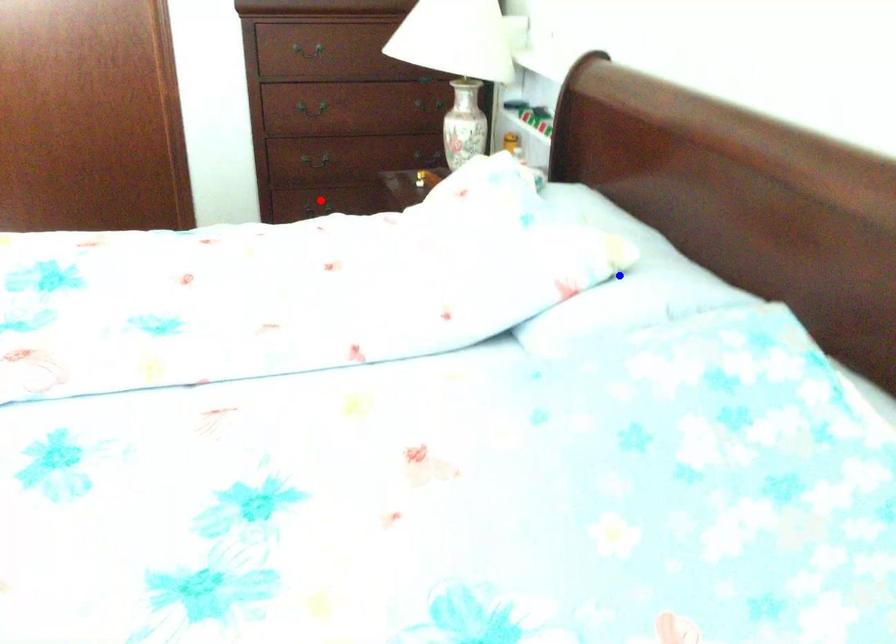
Question: In the image, two points are highlighted. Which point is nearer to the camera? Reply with the corresponding letter.

Choices:
 (A) blue point
 (B) red point

Answer: (A)